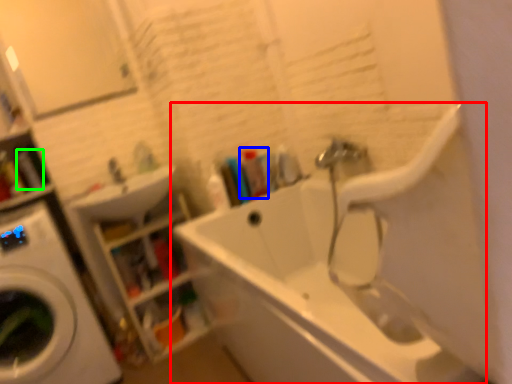
Question: Estimate the real-world distances between objects in this image. Which object is farther from bathtub (highlighted by a red box), toiletry (highlighted by a blue box) or toiletry (highlighted by a green box)?

Choices:
 (A) toiletry
 (B) toiletry

Answer: (B)